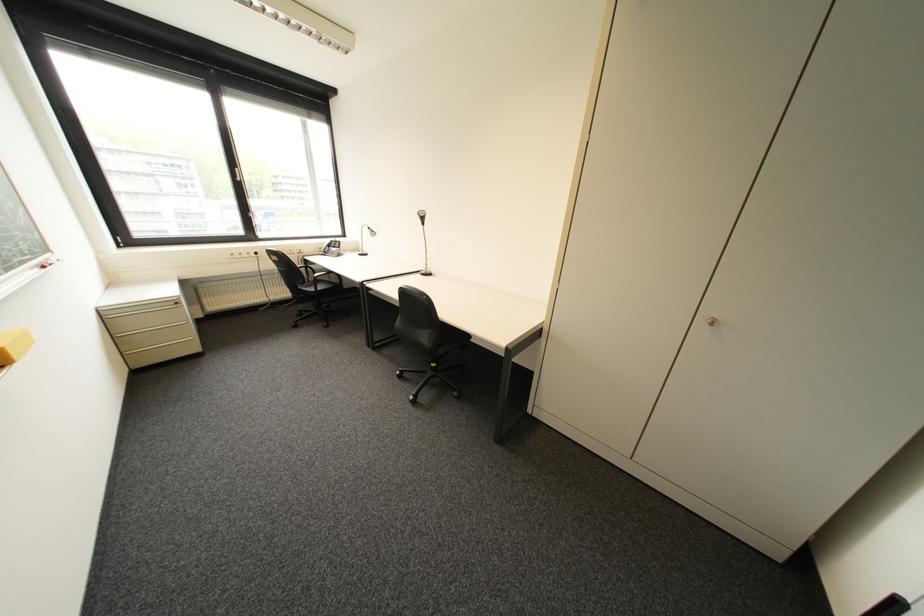
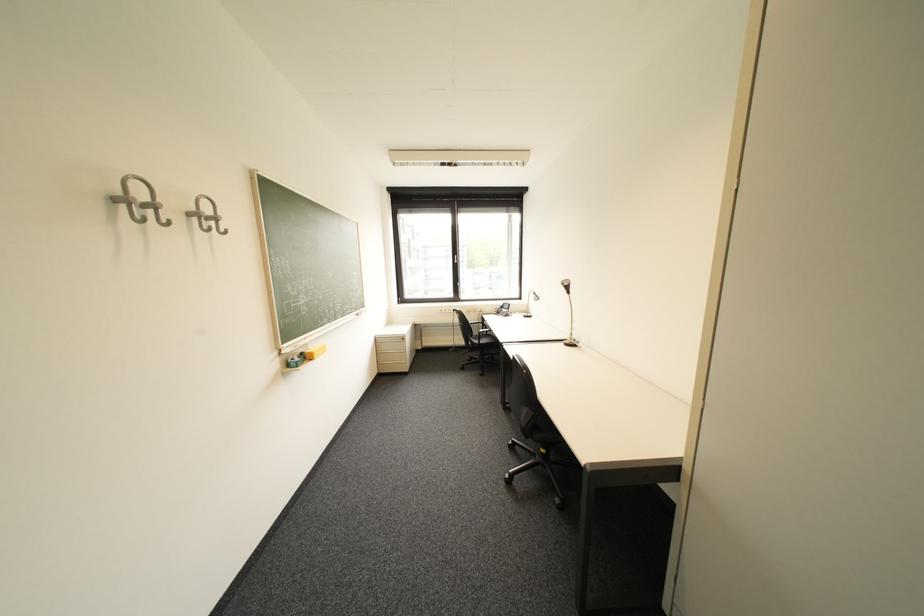
The point at (119, 318) is marked in the first image. Where is the corresponding point in the second image?

(388, 342)